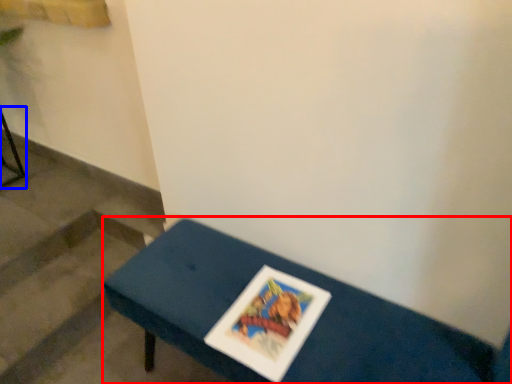
Question: Which of the following is the closest to the observer, table (highlighted by a red box) or furniture (highlighted by a blue box)?

Choices:
 (A) table
 (B) furniture

Answer: (A)